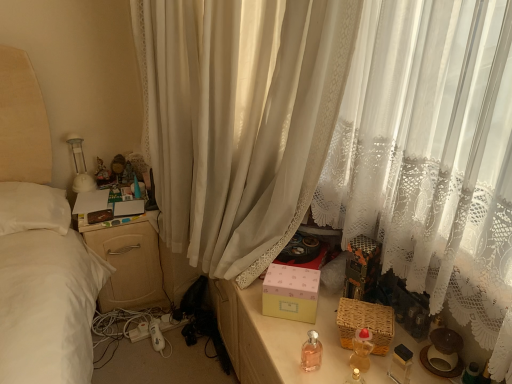
The width and height of the screenshot is (512, 384). Find the location of `pink matte box at center`. pink matte box at center is located at coordinates (290, 293).

Where is `pink glass bottle at center, which is counted as the 2th baby bottle, starting from the right`? Image resolution: width=512 pixels, height=384 pixels. pink glass bottle at center, which is counted as the 2th baby bottle, starting from the right is located at coordinates (311, 352).

Identify the location of matte plastic figurine at upper left. The image size is (512, 384). [x=102, y=173].

Is beige wood nightstand at left not near translucent plastic baby bottle at lower right, the second baby bottle positioned from the left?

Yes, beige wood nightstand at left is far from translucent plastic baby bottle at lower right, the second baby bottle positioned from the left.

Considering the relative sizes of beige wood nightstand at left and translucent plastic baby bottle at lower right, the second baby bottle positioned from the left, in the image provided, is beige wood nightstand at left taller than translucent plastic baby bottle at lower right, the second baby bottle positioned from the left,?

Yes.

From the image's perspective, is beige wood nightstand at left above translucent plastic baby bottle at lower right, the second baby bottle positioned from the left?

Yes.

Is beige wood nightstand at left outside of translucent plastic baby bottle at lower right, the second baby bottle positioned from the left?

Indeed, beige wood nightstand at left is completely outside translucent plastic baby bottle at lower right, the second baby bottle positioned from the left.

Is matte plastic figurine at upper left to the left of white sheer curtain at center from the viewer's perspective?

Yes, matte plastic figurine at upper left is to the left of white sheer curtain at center.

From the picture: Are matte plastic figurine at upper left and white sheer curtain at center making contact?

No, matte plastic figurine at upper left is not next to white sheer curtain at center.

From the image's perspective, relative to white sheer curtain at center, is matte plastic figurine at upper left above or below?

matte plastic figurine at upper left is situated lower than white sheer curtain at center in the image.

Considering the relative sizes of white sheer curtain at center and woven brown basket at lower right in the image provided, is white sheer curtain at center taller than woven brown basket at lower right?

Yes, white sheer curtain at center is taller than woven brown basket at lower right.

Is woven brown basket at lower right at the back of white sheer curtain at center?

white sheer curtain at center is not turned away from woven brown basket at lower right.

Which is closer, [278,159] or [375,341]?

The point [375,341] is closer.

Locate an element on the screen. baby bottle that is above the pink glass bottle at center, which is counted as the 2th baby bottle, starting from the right (from the image's perspective) is located at coordinates (361, 350).

Which of these two, translucent plastic baby bottle at lower right, the second baby bottle positioned from the left, or pink glass bottle at center, which is counted as the 2th baby bottle, starting from the right, is bigger?

Bigger between the two is translucent plastic baby bottle at lower right, the second baby bottle positioned from the left.

Considering the relative positions of translucent plastic baby bottle at lower right, the second baby bottle positioned from the left, and pink glass bottle at center, the first baby bottle positioned from the left, in the image provided, is translucent plastic baby bottle at lower right, the second baby bottle positioned from the left, to the left of pink glass bottle at center, the first baby bottle positioned from the left, from the viewer's perspective?

No, translucent plastic baby bottle at lower right, the second baby bottle positioned from the left, is not to the left of pink glass bottle at center, the first baby bottle positioned from the left.

Is translucent plastic baby bottle at lower right, placed as the first baby bottle when sorted from right to left, directly adjacent to pink glass bottle at center, the first baby bottle positioned from the left?

No, translucent plastic baby bottle at lower right, placed as the first baby bottle when sorted from right to left, is not with pink glass bottle at center, the first baby bottle positioned from the left.

Considering the relative positions of woven brown basket at lower right and translucent plastic baby bottle at lower right, placed as the first baby bottle when sorted from right to left, in the image provided, is woven brown basket at lower right behind translucent plastic baby bottle at lower right, placed as the first baby bottle when sorted from right to left,?

Yes, the depth of woven brown basket at lower right is greater than that of translucent plastic baby bottle at lower right, placed as the first baby bottle when sorted from right to left.

Can you tell me how much woven brown basket at lower right and translucent plastic baby bottle at lower right, the second baby bottle positioned from the left, differ in facing direction?

56.2 degrees separate the facing orientations of woven brown basket at lower right and translucent plastic baby bottle at lower right, the second baby bottle positioned from the left.

Considering the relative sizes of woven brown basket at lower right and translucent plastic baby bottle at lower right, placed as the first baby bottle when sorted from right to left, in the image provided, is woven brown basket at lower right shorter than translucent plastic baby bottle at lower right, placed as the first baby bottle when sorted from right to left,?

Yes.

Could matte plastic figurine at upper left be considered to be inside pink matte box at center?

Actually, matte plastic figurine at upper left is outside pink matte box at center.

Considering the relative positions of pink matte box at center and matte plastic figurine at upper left in the image provided, is pink matte box at center behind matte plastic figurine at upper left?

No, it is not.

From a real-world perspective, which is physically above, pink matte box at center or matte plastic figurine at upper left?

matte plastic figurine at upper left is physically above.

Is pink matte box at center oriented towards matte plastic figurine at upper left?

No, pink matte box at center is not turned towards matte plastic figurine at upper left.

Considering the positions of objects pink matte box at center and woven brown basket at lower right in the image provided, who is behind, pink matte box at center or woven brown basket at lower right?

pink matte box at center is behind.

Is point (295, 307) closer or farther from the camera than point (368, 311)?

Point (295, 307).

Are pink matte box at center and woven brown basket at lower right making contact?

pink matte box at center and woven brown basket at lower right are clearly separated.

Image resolution: width=512 pixels, height=384 pixels. There is a woven brown basket at lower right. What are the coordinates of `box above it (from a real-world perspective)` in the screenshot? It's located at (290, 293).

Locate an element on the screen. The height and width of the screenshot is (384, 512). nightstand on the left of the translucent plastic baby bottle at lower right, the second baby bottle positioned from the left is located at coordinates (129, 263).

This screenshot has height=384, width=512. In order to click on curtain that is on the right side of matte plastic figurine at upper left in this screenshot , I will do `click(239, 119)`.

Considering their positions, is matte plastic figurine at upper left positioned further to pink matte box at center than translucent plastic baby bottle at lower right, placed as the first baby bottle when sorted from right to left?

matte plastic figurine at upper left is positioned further to the anchor pink matte box at center.

Looking at this image, when comparing their distances from beige wood nightstand at left, does pink matte box at center or translucent plastic baby bottle at lower right, the second baby bottle positioned from the left, seem further?

translucent plastic baby bottle at lower right, the second baby bottle positioned from the left, is positioned further to the anchor beige wood nightstand at left.

Which object lies nearer to the anchor point matte plastic figurine at upper left, woven brown basket at lower right or white sheer curtain at center?

Among the two, white sheer curtain at center is located nearer to matte plastic figurine at upper left.

Considering their positions, is pink glass bottle at center, the first baby bottle positioned from the left, positioned further to pink matte box at center than beige wood nightstand at left?

beige wood nightstand at left.

Considering their positions, is translucent plastic baby bottle at lower right, placed as the first baby bottle when sorted from right to left, positioned further to pink glass bottle at center, the first baby bottle positioned from the left, than white sheer curtain at center?

Based on the image, white sheer curtain at center appears to be further to pink glass bottle at center, the first baby bottle positioned from the left.

Estimate the real-world distances between objects in this image. Which object is further from beige wood nightstand at left, woven brown basket at lower right or matte plastic figurine at upper left?

woven brown basket at lower right is positioned further to the anchor beige wood nightstand at left.

Estimate the real-world distances between objects in this image. Which object is further from white sheer curtain at center, pink matte box at center or pink glass bottle at center, which is counted as the 2th baby bottle, starting from the right?

The object further to white sheer curtain at center is pink glass bottle at center, which is counted as the 2th baby bottle, starting from the right.

When comparing their distances from beige wood nightstand at left, does matte plastic figurine at upper left or woven brown basket at lower right seem further?

Among the two, woven brown basket at lower right is located further to beige wood nightstand at left.

I want to click on nightstand situated between matte plastic figurine at upper left and pink matte box at center from left to right, so click(129, 263).

Where is `basket between white sheer curtain at center and matte plastic figurine at upper left in the front-back direction`? The width and height of the screenshot is (512, 384). basket between white sheer curtain at center and matte plastic figurine at upper left in the front-back direction is located at coordinates (365, 323).

I want to click on basket between white sheer curtain at center and translucent plastic baby bottle at lower right, placed as the first baby bottle when sorted from right to left, in the up-down direction, so click(365, 323).

Locate an element on the screen. The width and height of the screenshot is (512, 384). baby bottle situated between matte plastic figurine at upper left and translucent plastic baby bottle at lower right, the second baby bottle positioned from the left, from left to right is located at coordinates (311, 352).